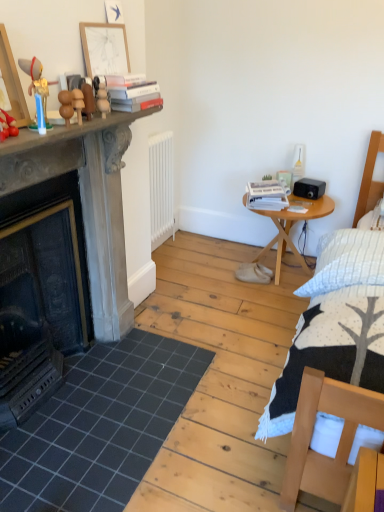
Question: Based on their sizes in the image, would you say wooden round table at right is bigger or smaller than wooden balls at upper left, positioned as the 2th toy in right-to-left order?

Choices:
 (A) small
 (B) big

Answer: (B)

Question: From the image's perspective, relative to wooden balls at upper left, placed as the 2th toy when sorted from left to right, is wooden round table at right above or below?

Choices:
 (A) above
 (B) below

Answer: (B)

Question: Which is nearer to the wooden balls at upper left, which appears as the 2th toy when viewed from the front?

Choices:
 (A) white matte radiator at center
 (B) white paper stack at right, the 1th book viewed from the back
 (C) wooden round table at right
 (D) wooden figurine at left, the 3th toy viewed from the right
 (E) hardcover books at upper center, which appears as the second book when viewed from the back

Answer: (D)

Question: Estimate the real-world distances between objects in this image. Which object is closer to the wooden picture frame at upper center, which appears as the 1th picture frame when viewed from the right?

Choices:
 (A) white paper stack at right, the first book viewed from the right
 (B) dark gray tile at lower left
 (C) wooden picture frame at left, the first picture frame when ordered from left to right
 (D) wooden round table at right
 (E) wooden figurine at left, the 3th toy viewed from the right

Answer: (C)